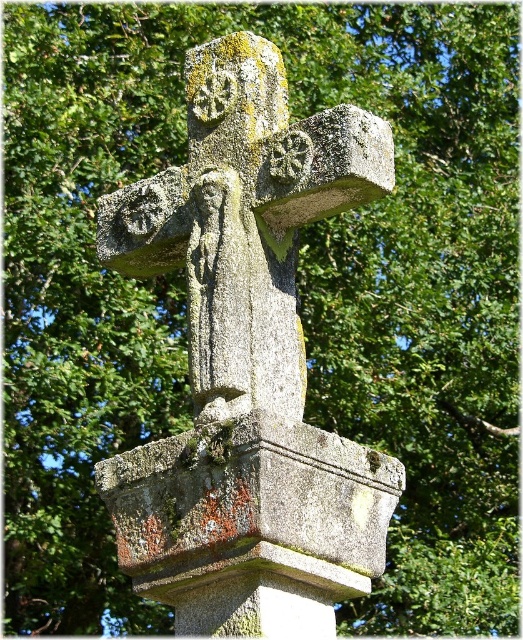
You are a GUI agent. You are given a task and a screenshot of the screen. Output one action in this format:
    pyautogui.click(x=<x>, y=<y>)
    Task: Click on the gray stone cross at center
    
    Given the screenshot: What is the action you would take?
    pyautogui.click(x=244, y=220)

Is gray stone cross at center smaller than gray stone pedestal at center?

Incorrect, gray stone cross at center is not smaller in size than gray stone pedestal at center.

The image size is (523, 640). I want to click on gray stone cross at center, so click(244, 220).